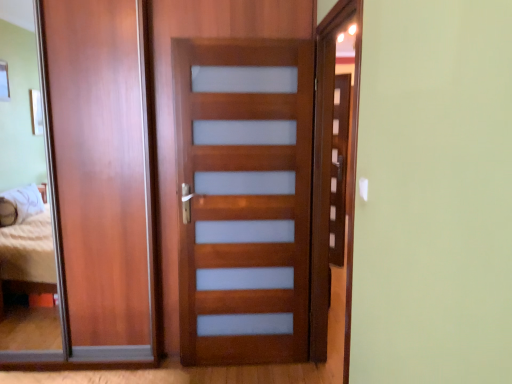
Question: Which direction should I rotate to look at satin wood door at center, which is the first screen door from left to right?

Choices:
 (A) left
 (B) right

Answer: (A)

Question: Considering the relative sizes of matte wood barn door at left and satin wood door at center, acting as the second screen door starting from the right, in the image provided, is matte wood barn door at left taller than satin wood door at center, acting as the second screen door starting from the right,?

Choices:
 (A) yes
 (B) no

Answer: (A)

Question: Is matte wood barn door at left smaller than satin wood door at center, acting as the second screen door starting from the right?

Choices:
 (A) yes
 (B) no

Answer: (B)

Question: From a real-world perspective, is matte wood barn door at left physically below satin wood door at center, which is the first screen door from left to right?

Choices:
 (A) yes
 (B) no

Answer: (B)

Question: Is matte wood barn door at left positioned behind satin wood door at center, acting as the second screen door starting from the right?

Choices:
 (A) no
 (B) yes

Answer: (B)

Question: From the image's perspective, is matte wood barn door at left over satin wood door at center, which is the first screen door from left to right?

Choices:
 (A) no
 (B) yes

Answer: (B)

Question: From the image's perspective, is matte wood barn door at left beneath satin wood door at center, acting as the second screen door starting from the right?

Choices:
 (A) no
 (B) yes

Answer: (A)

Question: Does matte wood screen door at right, which is the 2th screen door in left-to-right order, have a greater height compared to matte wood barn door at left?

Choices:
 (A) no
 (B) yes

Answer: (A)

Question: Can you confirm if matte wood screen door at right, acting as the 1th screen door starting from the right, is bigger than matte wood barn door at left?

Choices:
 (A) no
 (B) yes

Answer: (A)

Question: From the image's perspective, is matte wood screen door at right, acting as the 1th screen door starting from the right, beneath matte wood barn door at left?

Choices:
 (A) no
 (B) yes

Answer: (B)

Question: Does matte wood screen door at right, acting as the 1th screen door starting from the right, have a smaller size compared to matte wood barn door at left?

Choices:
 (A) yes
 (B) no

Answer: (A)

Question: Can matte wood barn door at left be found inside matte wood screen door at right, acting as the 1th screen door starting from the right?

Choices:
 (A) yes
 (B) no

Answer: (B)

Question: Is matte wood screen door at right, acting as the 1th screen door starting from the right, wider than matte wood barn door at left?

Choices:
 (A) no
 (B) yes

Answer: (A)

Question: Is matte wood barn door at left shorter than matte wood screen door at right, acting as the 1th screen door starting from the right?

Choices:
 (A) no
 (B) yes

Answer: (A)